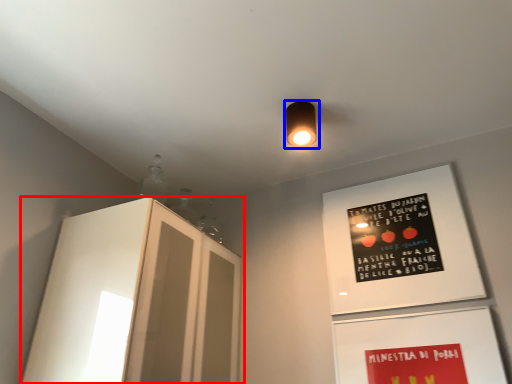
Question: Which object is further to the camera taking this photo, cabinetry (highlighted by a red box) or lamp (highlighted by a blue box)?

Choices:
 (A) cabinetry
 (B) lamp

Answer: (B)